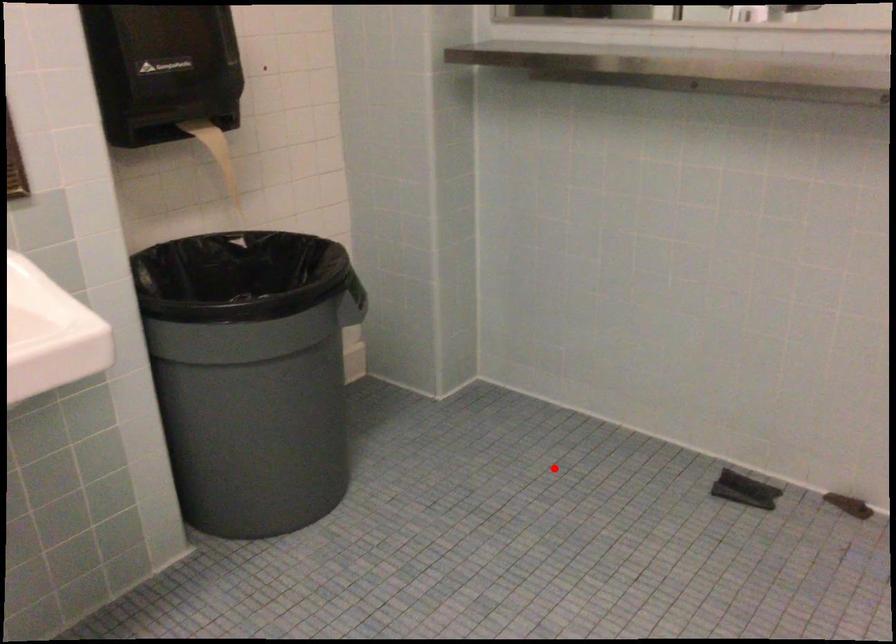
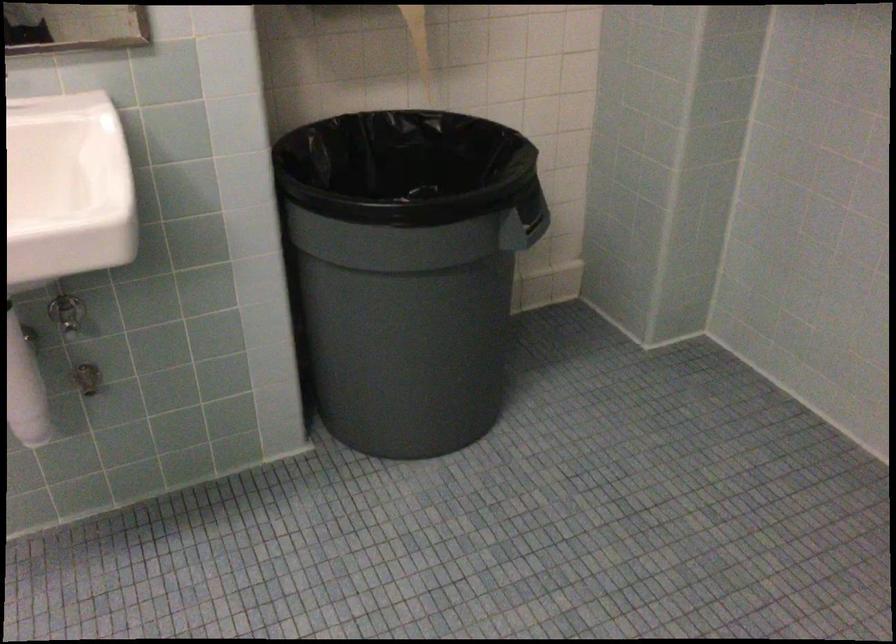
Find the pixel in the second image that matches the highlighted location in the first image.

(745, 469)